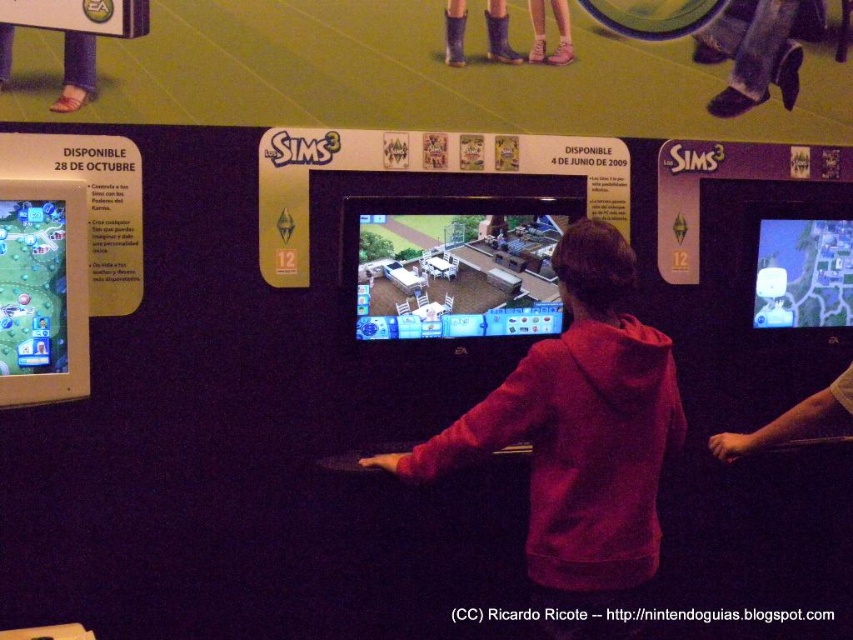
Between matte plastic screen at center and white matte hand at center, which one is positioned higher?

matte plastic screen at center

Between point (500, 328) and point (746, 449), which one is positioned in front?

Positioned in front is point (746, 449).

At what (x,y) coordinates should I click in order to perform the action: click on matte plastic screen at center. Please return your answer as a coordinate pair (x, y). Looking at the image, I should click on (451, 269).

Describe the element at coordinates (76, 72) in the screenshot. I see `leather boots at upper left` at that location.

Can you confirm if leather boots at upper left is thinner than leather boots at upper center?

In fact, leather boots at upper left might be wider than leather boots at upper center.

Identify the location of leather boots at upper left. The image size is (853, 640). (76, 72).

Does matte blue map at center have a greater height compared to purple rubber boots at upper center?

Yes.

Who is positioned more to the right, matte blue map at center or purple rubber boots at upper center?

matte blue map at center is more to the right.

At what (x,y) coordinates should I click in order to perform the action: click on matte blue map at center. Please return your answer as a coordinate pair (x, y). The image size is (853, 640). Looking at the image, I should click on (804, 273).

You are a GUI agent. You are given a task and a screenshot of the screen. Output one action in this format:
    pyautogui.click(x=<x>, y=<y>)
    Task: Click on the matte blue map at center
    Image resolution: width=853 pixels, height=640 pixels.
    Given the screenshot: What is the action you would take?
    pyautogui.click(x=804, y=273)